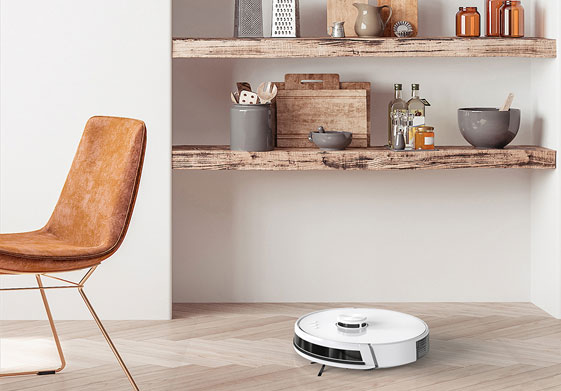
You are a GUI agent. You are given a task and a screenshot of the screen. Output one action in this format:
    pyautogui.click(x=<x>, y=<y>)
    Task: Click on the pitcher
    
    Given the screenshot: What is the action you would take?
    pyautogui.click(x=373, y=25)